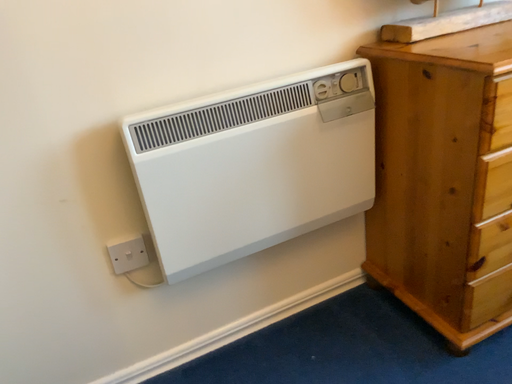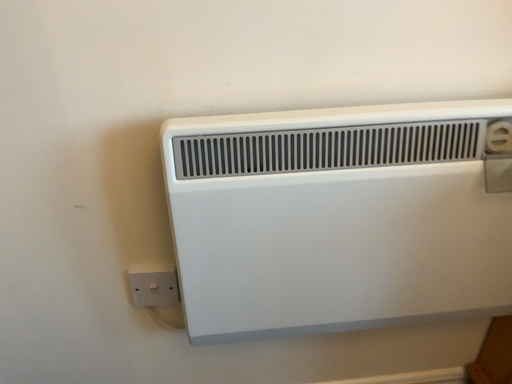
Question: How did the camera likely rotate when shooting the video?

Choices:
 (A) rotated left
 (B) rotated right

Answer: (A)